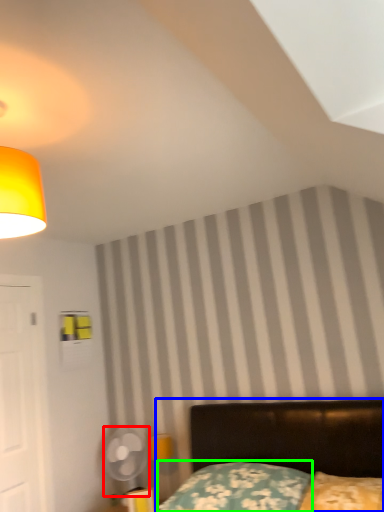
Question: Considering the real-world distances, which object is farthest from mechanical fan (highlighted by a red box)? bed (highlighted by a blue box) or pillow (highlighted by a green box)?

Choices:
 (A) bed
 (B) pillow

Answer: (A)